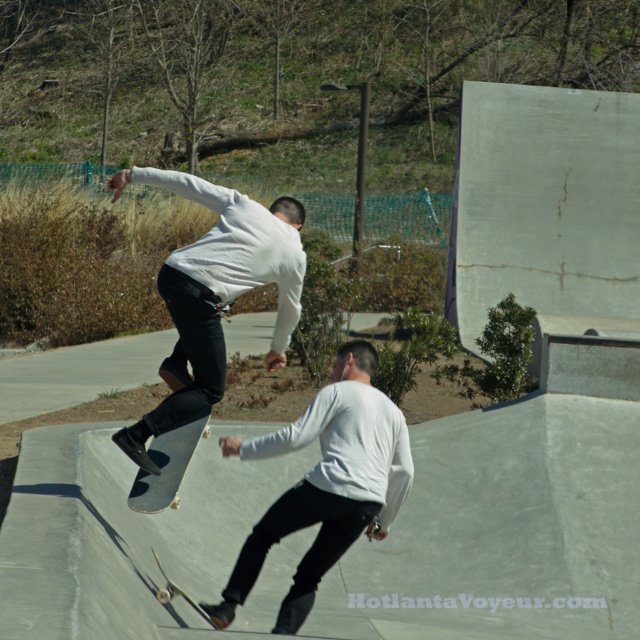
Question: Can you confirm if matte white shirt at center is bigger than wooden skateboard at lower center?

Choices:
 (A) no
 (B) yes

Answer: (A)

Question: Which point is closer to the camera?

Choices:
 (A) (406, 465)
 (B) (208, 620)

Answer: (A)

Question: Can you confirm if matte white shirt at center is smaller than wooden skateboard at lower center?

Choices:
 (A) no
 (B) yes

Answer: (B)

Question: Is white matte shirt at center further to the viewer compared to wooden skateboard at lower center?

Choices:
 (A) no
 (B) yes

Answer: (A)

Question: Which point is farther to the camera?

Choices:
 (A) (205, 300)
 (B) (356, 474)
 (C) (150, 496)
 (D) (192, 605)

Answer: (D)

Question: Which object appears farthest from the camera in this image?

Choices:
 (A) white matte shirt at center
 (B) wooden skateboard at center
 (C) wooden skateboard at lower center
 (D) matte white shirt at center

Answer: (B)